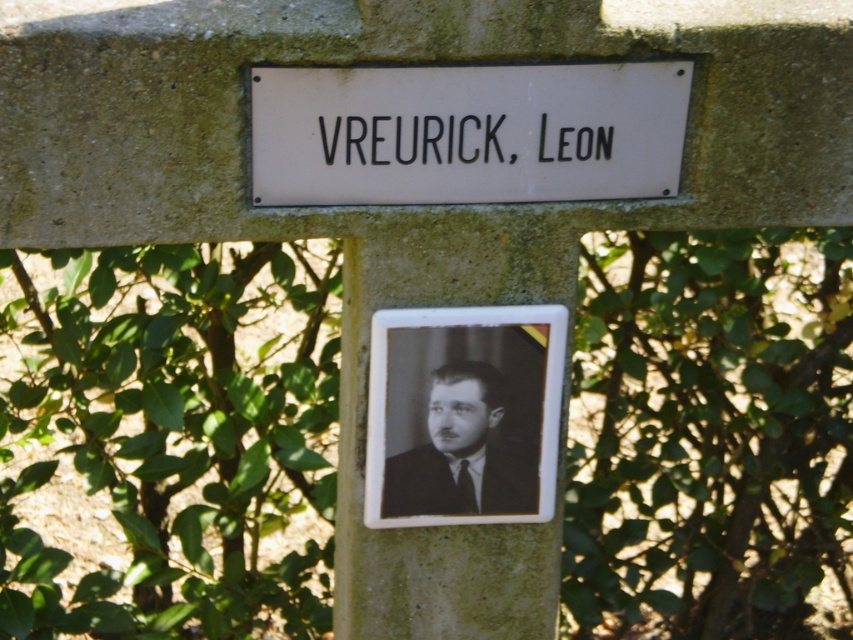
You are standing in front of a stone marker with a plaque and a photo. There is a point marked at coordinates (467, 132). What object is located at this point?

The white matte sign at center is located at point (467, 132).

You are standing 1.5 meters away from the white matte sign at center. You want to take a photo of it using a camera that requires a minimum distance of 2 meters for clear focus. Can you take a clear photo without moving closer or farther away?

The white matte sign at center and camera are 1.90 meters apart. Since the required minimum distance is 2 meters, you are too close to achieve clear focus. You need to move back 0.1 meters.